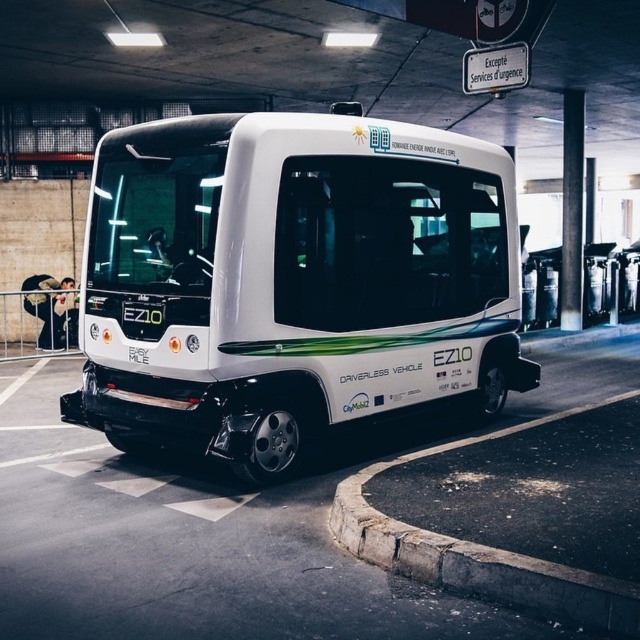
You are standing at the entrance of the parking garage and see the white glossy driverless vehicle at center and the concrete at lower right. Which object is closer to your right side?

The white glossy driverless vehicle at center is to the right of concrete at lower right, so the white glossy driverless vehicle at center is closer to your right side.